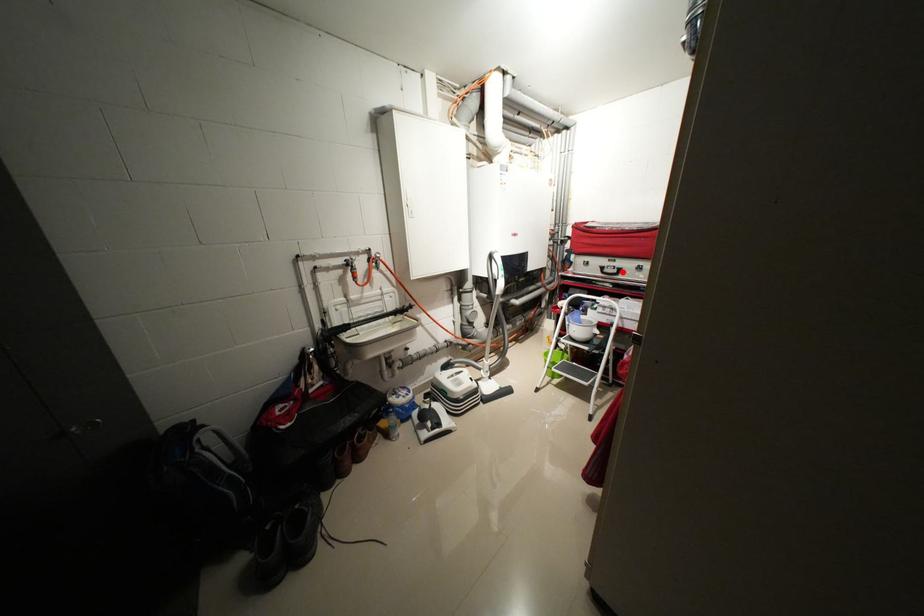
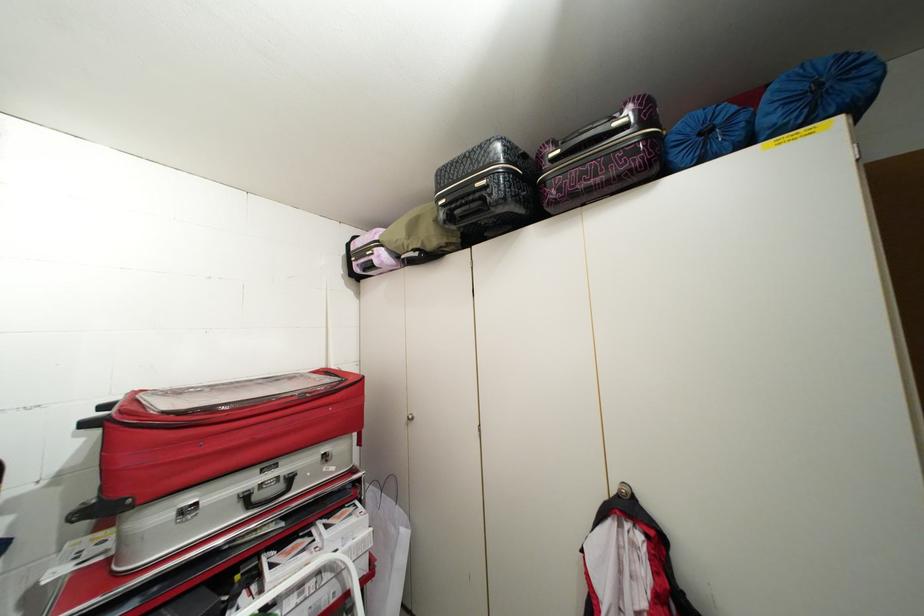
Where in the second image is the point corresponding to the highlighted location from the first image?

(287, 487)